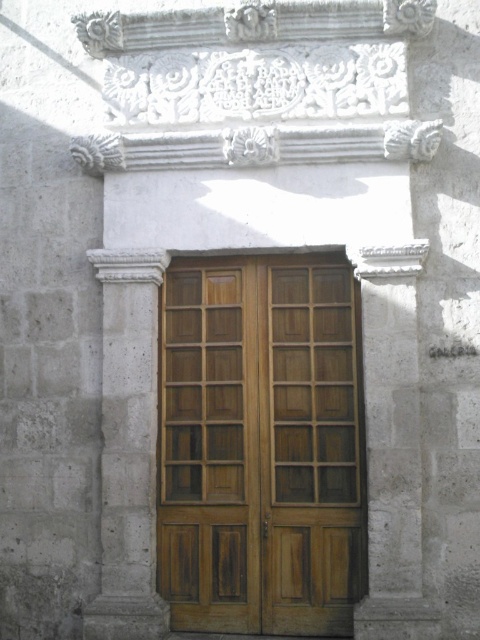
Does wooden/glass door at center have a lesser height compared to wooden door at center?

In fact, wooden/glass door at center may be taller than wooden door at center.

Who is shorter, wooden/glass door at center or wooden door at center?

Standing shorter between the two is wooden door at center.

I want to click on wooden/glass door at center, so click(x=261, y=445).